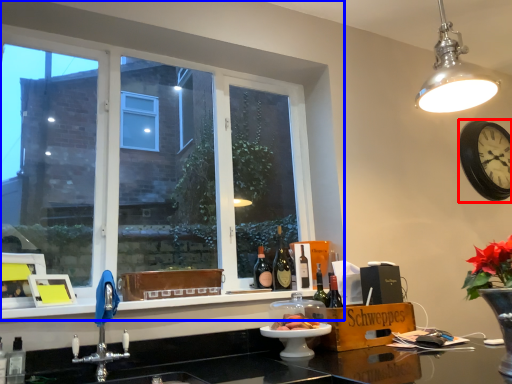
Question: Which of the following is the closest to the observer, clock (highlighted by a red box) or window (highlighted by a blue box)?

Choices:
 (A) clock
 (B) window

Answer: (B)